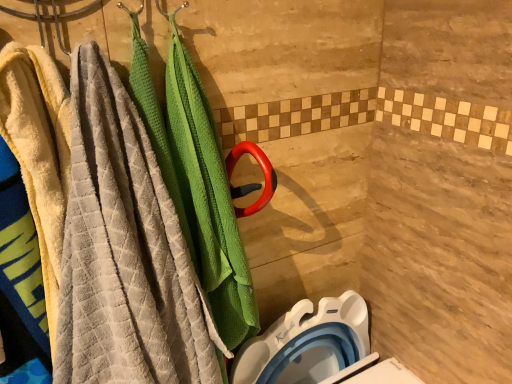
What is the approximate height of textured gray towel at left?

textured gray towel at left is 29.62 inches in height.

Find the location of a particular element. The image size is (512, 384). textured gray towel at left is located at coordinates (111, 233).

At what (x,y) coordinates should I click in order to perform the action: click on soft yellow towel at left. Please return your answer as a coordinate pair (x, y). This screenshot has width=512, height=384. Looking at the image, I should click on (39, 152).

From the image's perspective, is soft yellow towel at left above or below textured gray towel at left?

Clearly, from the image's perspective, soft yellow towel at left is above textured gray towel at left.

From a real-world perspective, which object rests below the other?

In real-world perspective, textured gray towel at left is lower.

Between soft yellow towel at left and textured gray towel at left, which one is positioned in front?

Positioned in front is textured gray towel at left.

Which of these two, soft yellow towel at left or textured gray towel at left, stands taller?

textured gray towel at left is taller.

Is white plastic toilet bowl at lower right completely or partially outside of soft yellow towel at left?

white plastic toilet bowl at lower right is positioned outside soft yellow towel at left.

Can you confirm if white plastic toilet bowl at lower right is taller than soft yellow towel at left?

No.

How many degrees apart are the facing directions of white plastic toilet bowl at lower right and soft yellow towel at left?

6.78 degrees separate the facing orientations of white plastic toilet bowl at lower right and soft yellow towel at left.

Is point (341, 306) closer or farther from the camera than point (35, 49)?

Point (341, 306) appears to be farther away from the viewer than point (35, 49).

Where is `beach towel above the textured gray towel at left (from a real-world perspective)`? This screenshot has width=512, height=384. beach towel above the textured gray towel at left (from a real-world perspective) is located at coordinates (39, 152).

From the image's perspective, is textured gray towel at left positioned above or below soft yellow towel at left?

From the image's perspective, textured gray towel at left appears below soft yellow towel at left.

Which is closer to the camera, (128, 284) or (51, 96)?

Point (51, 96)

Is textured gray towel at left not within soft yellow towel at left?

Absolutely, textured gray towel at left is external to soft yellow towel at left.

This screenshot has width=512, height=384. I want to click on toilet bowl that is on the right side of textured gray towel at left, so click(x=318, y=348).

Which of these two, white plastic toilet bowl at lower right or textured gray towel at left, is smaller?

white plastic toilet bowl at lower right is smaller.

Which is correct: white plastic toilet bowl at lower right is inside textured gray towel at left, or outside of it?

The correct answer is: outside.

Is textured gray towel at left far from white plastic toilet bowl at lower right?

textured gray towel at left is actually quite close to white plastic toilet bowl at lower right.

You are a GUI agent. You are given a task and a screenshot of the screen. Output one action in this format:
    pyautogui.click(x=<x>, y=<y>)
    Task: Click on the toilet bowl below the textured gray towel at left (from a real-world perspective)
    
    Given the screenshot: What is the action you would take?
    pyautogui.click(x=318, y=348)

Which is more to the right, textured gray towel at left or white plastic toilet bowl at lower right?

From the viewer's perspective, white plastic toilet bowl at lower right appears more on the right side.

Can white plastic toilet bowl at lower right be found inside textured gray towel at left?

No, white plastic toilet bowl at lower right is not inside textured gray towel at left.

Between soft yellow towel at left and white plastic toilet bowl at lower right, which one is positioned behind?

white plastic toilet bowl at lower right is more distant.

From a real-world perspective, is soft yellow towel at left physically located above or below white plastic toilet bowl at lower right?

soft yellow towel at left is situated higher than white plastic toilet bowl at lower right in the real world.

Who is bigger, soft yellow towel at left or white plastic toilet bowl at lower right?

soft yellow towel at left.

The height and width of the screenshot is (384, 512). Find the location of `beach towel above the textured gray towel at left (from a real-world perspective)`. beach towel above the textured gray towel at left (from a real-world perspective) is located at coordinates (39, 152).

This screenshot has width=512, height=384. I want to click on toilet bowl behind the soft yellow towel at left, so click(x=318, y=348).

When comparing their distances from soft yellow towel at left, does white plastic toilet bowl at lower right or textured gray towel at left seem closer?

textured gray towel at left is positioned closer to the anchor soft yellow towel at left.

From the picture: Based on their spatial positions, is white plastic toilet bowl at lower right or soft yellow towel at left further from textured gray towel at left?

white plastic toilet bowl at lower right.

Considering their positions, is soft yellow towel at left positioned further to white plastic toilet bowl at lower right than textured gray towel at left?

soft yellow towel at left is positioned further to the anchor white plastic toilet bowl at lower right.

Considering their positions, is textured gray towel at left positioned closer to white plastic toilet bowl at lower right than soft yellow towel at left?

textured gray towel at left lies closer to white plastic toilet bowl at lower right than the other object.

Looking at the image, which one is located further to textured gray towel at left, soft yellow towel at left or white plastic toilet bowl at lower right?

The object further to textured gray towel at left is white plastic toilet bowl at lower right.

Estimate the real-world distances between objects in this image. Which object is further from soft yellow towel at left, textured gray towel at left or white plastic toilet bowl at lower right?

white plastic toilet bowl at lower right.

Where is `beach towel located between textured gray towel at left and white plastic toilet bowl at lower right in the depth direction`? beach towel located between textured gray towel at left and white plastic toilet bowl at lower right in the depth direction is located at coordinates (39, 152).